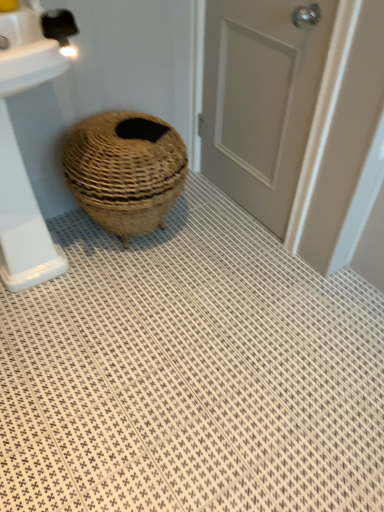
The width and height of the screenshot is (384, 512). I want to click on free space that is to the left of matte gray door at center, so click(x=200, y=205).